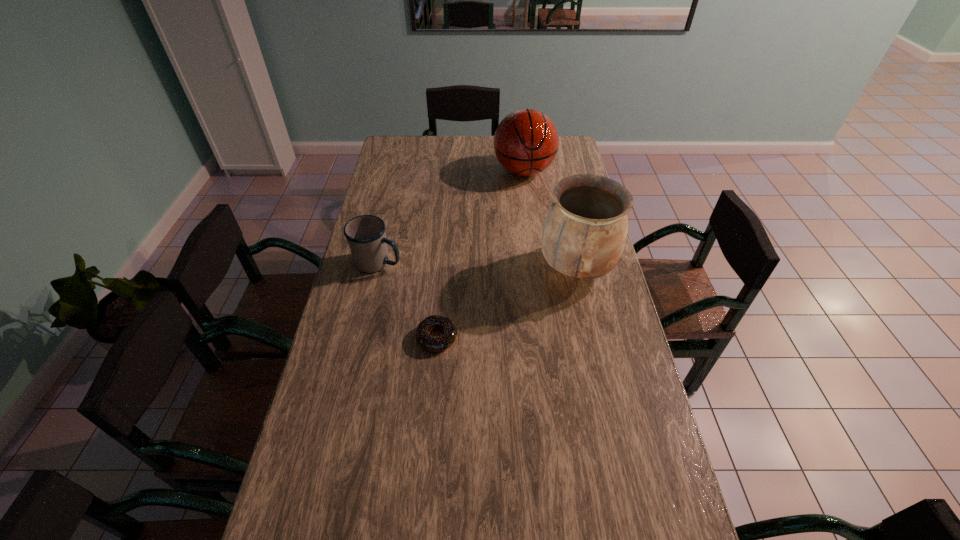
Where is `free spot on the desktop that is between the doughnut and the urn and is positioned on the side with spill of the basketball`? This screenshot has width=960, height=540. free spot on the desktop that is between the doughnut and the urn and is positioned on the side with spill of the basketball is located at coordinates (526, 294).

Identify the location of free space on the desktop that is between the nearest object and the urn and is positioned on the handle side of the second shortest object. (516, 299).